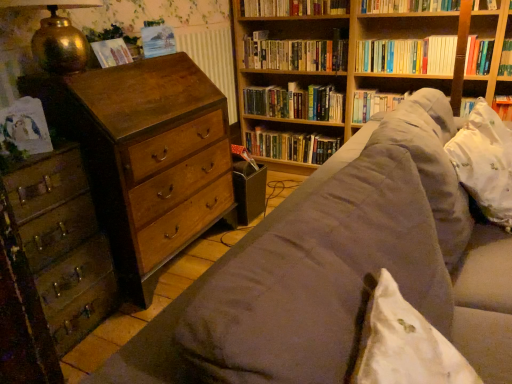
Question: Does point (391, 9) appear closer or farther from the camera than point (503, 16)?

Choices:
 (A) closer
 (B) farther

Answer: (B)

Question: From a real-world perspective, is hardcover book at upper center, placed as the 5th book when sorted from bottom to top, positioned above or below wooden bookshelf at upper right?

Choices:
 (A) above
 (B) below

Answer: (A)

Question: Which is nearer to the wooden chest of drawers at left, the second chest of drawers viewed from the right?

Choices:
 (A) gold textured lamp at upper left
 (B) wooden chest of drawers at left, placed as the second chest of drawers when sorted from left to right
 (C) wooden bookshelf at upper right
 (D) hardcover books at upper right, the fourth book positioned from the top
 (E) wooden bookshelf at upper center, acting as the 3th book starting from the top

Answer: (B)

Question: Which object is positioned closest to the hardcover book at upper center, placed as the 5th book when sorted from bottom to top?

Choices:
 (A) wooden bookshelf at upper center, which is counted as the fourth book, starting from the bottom
 (B) matte paper at upper left, marked as the second paperback book in a bottom-to-top arrangement
 (C) hardcover book at center, which appears as the 1th book when ordered from the bottom
 (D) wooden bookshelf at upper right
 (E) white floral fabric pillow at right

Answer: (D)